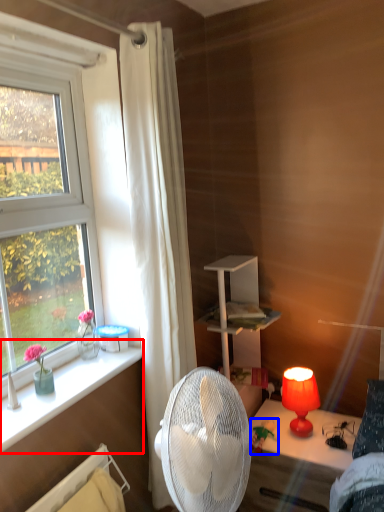
Question: Which object is further to the camera taking this photo, window sill (highlighted by a red box) or toy (highlighted by a blue box)?

Choices:
 (A) window sill
 (B) toy

Answer: (B)